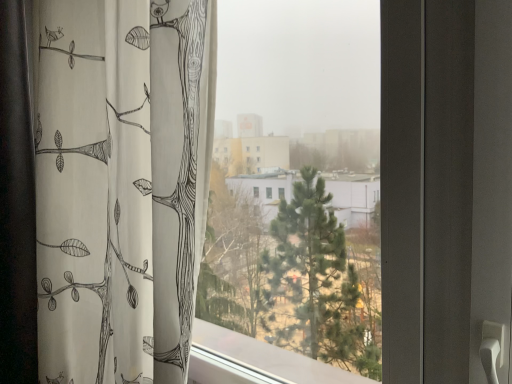
Image resolution: width=512 pixels, height=384 pixels. Describe the element at coordinates (296, 197) in the screenshot. I see `transparent glass window at center` at that location.

Identify the location of transparent glass window at center. (296, 197).

Find the location of a particular element. This screenshot has height=384, width=512. white fabric curtain at left is located at coordinates pyautogui.click(x=121, y=185).

Image resolution: width=512 pixels, height=384 pixels. Describe the element at coordinates (121, 185) in the screenshot. I see `white fabric curtain at left` at that location.

Identify the location of transparent glass window at center. (296, 197).

Between white fabric curtain at left and transparent glass window at center, which one appears on the right side from the viewer's perspective?

transparent glass window at center.

Which object is further away from the camera, white fabric curtain at left or transparent glass window at center?

white fabric curtain at left is further away from the camera.

Considering the points (123, 109) and (323, 332), which point is behind, point (123, 109) or point (323, 332)?

The point (323, 332) is behind.

Consider the image. From the image's perspective, is white fabric curtain at left under transparent glass window at center?

Yes, from the image's perspective, white fabric curtain at left is below transparent glass window at center.

From a real-world perspective, relative to transparent glass window at center, is white fabric curtain at left vertically above or below?

white fabric curtain at left is above transparent glass window at center.

Considering the sizes of objects white fabric curtain at left and transparent glass window at center in the image provided, who is wider, white fabric curtain at left or transparent glass window at center?

white fabric curtain at left.

Can you confirm if white fabric curtain at left is taller than transparent glass window at center?

Yes.

Between white fabric curtain at left and transparent glass window at center, which one has smaller size?

With smaller size is transparent glass window at center.

Is transparent glass window at center surrounded by white fabric curtain at left?

No.

Is white fabric curtain at left next to transparent glass window at center and touching it?

No, white fabric curtain at left is not in contact with transparent glass window at center.

Is white fabric curtain at left facing towards transparent glass window at center?

No, white fabric curtain at left is not facing towards transparent glass window at center.

Can you tell me how much white fabric curtain at left and transparent glass window at center differ in facing direction?

white fabric curtain at left and transparent glass window at center are facing 0.000634 degrees away from each other.

At what (x,y) coordinates should I click in order to perform the action: click on window in front of the white fabric curtain at left. Please return your answer as a coordinate pair (x, y). Looking at the image, I should click on (296, 197).

Is transparent glass window at center to the right of white fabric curtain at left from the viewer's perspective?

Correct, you'll find transparent glass window at center to the right of white fabric curtain at left.

Considering their positions, is transparent glass window at center located in front of or behind white fabric curtain at left?

transparent glass window at center is positioned closer to the viewer than white fabric curtain at left.

Which point is more forward, (332, 320) or (162, 363)?

Point (162, 363)

From the image's perspective, which is below, transparent glass window at center or white fabric curtain at left?

From the image's view, white fabric curtain at left is below.

From a real-world perspective, is transparent glass window at center positioned under white fabric curtain at left based on gravity?

Yes.

Which object is thinner, transparent glass window at center or white fabric curtain at left?

Thinner between the two is transparent glass window at center.

Who is taller, transparent glass window at center or white fabric curtain at left?

white fabric curtain at left is taller.

Considering the relative sizes of transparent glass window at center and white fabric curtain at left in the image provided, is transparent glass window at center smaller than white fabric curtain at left?

Indeed, transparent glass window at center has a smaller size compared to white fabric curtain at left.

Is transparent glass window at center located outside white fabric curtain at left?

That's correct, transparent glass window at center is outside of white fabric curtain at left.

Is transparent glass window at center with white fabric curtain at left?

No, transparent glass window at center is not making contact with white fabric curtain at left.

In the scene shown: Is transparent glass window at center facing towards white fabric curtain at left?

Yes, transparent glass window at center is facing white fabric curtain at left.

How many degrees apart are the facing directions of transparent glass window at center and white fabric curtain at left?

There is a 0.000634-degree angle between the facing directions of transparent glass window at center and white fabric curtain at left.

This screenshot has width=512, height=384. I want to click on window located above the white fabric curtain at left (from the image's perspective), so click(296, 197).

Locate an element on the screen. curtain above the transparent glass window at center (from a real-world perspective) is located at coordinates (121, 185).

Where is `window located underneath the white fabric curtain at left (from a real-world perspective)`? window located underneath the white fabric curtain at left (from a real-world perspective) is located at coordinates (296, 197).